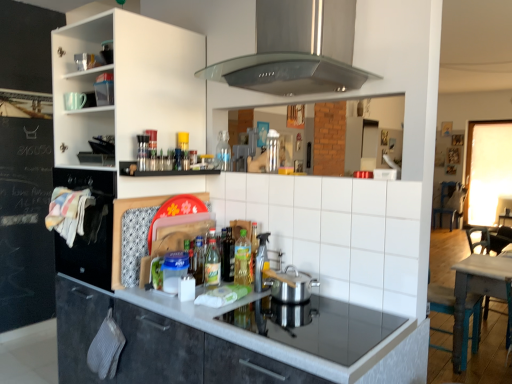
Question: Does green plastic bottle at center, which is counted as the 2th bottle, starting from the front, have a smaller size compared to wooden chair at right, which is the 2th chair in right-to-left order?

Choices:
 (A) yes
 (B) no

Answer: (A)

Question: Is green plastic bottle at center, the third bottle when ordered from back to front, aimed at wooden chair at right, which ranks as the second chair in back-to-front order?

Choices:
 (A) no
 (B) yes

Answer: (A)

Question: Is wooden chair at right, the first chair viewed from the left, inside green plastic bottle at center, the third bottle when ordered from back to front?

Choices:
 (A) no
 (B) yes

Answer: (A)

Question: From the image's perspective, is green plastic bottle at center, positioned as the 2th bottle in bottom-to-top order, located above wooden chair at right, the first chair viewed from the left?

Choices:
 (A) yes
 (B) no

Answer: (A)

Question: Is green plastic bottle at center, the 3th bottle in the top-to-bottom sequence, not close to wooden chair at right, which ranks as the second chair in back-to-front order?

Choices:
 (A) yes
 (B) no

Answer: (A)

Question: Can you confirm if green plastic bottle at center, the 3th bottle in the top-to-bottom sequence, is positioned to the left of wooden chair at right, which ranks as the second chair in back-to-front order?

Choices:
 (A) no
 (B) yes

Answer: (B)

Question: Can we say dark gray laminate cabinet at center lies outside metallic silver shelf at upper center?

Choices:
 (A) no
 (B) yes

Answer: (B)

Question: Is dark gray laminate cabinet at center thinner than metallic silver shelf at upper center?

Choices:
 (A) yes
 (B) no

Answer: (B)

Question: Is the position of dark gray laminate cabinet at center less distant than that of metallic silver shelf at upper center?

Choices:
 (A) no
 (B) yes

Answer: (B)

Question: Does dark gray laminate cabinet at center have a lesser height compared to metallic silver shelf at upper center?

Choices:
 (A) no
 (B) yes

Answer: (A)

Question: From a real-world perspective, is dark gray laminate cabinet at center located beneath metallic silver shelf at upper center?

Choices:
 (A) yes
 (B) no

Answer: (A)

Question: Is dark gray laminate cabinet at center not close to metallic silver shelf at upper center?

Choices:
 (A) yes
 (B) no

Answer: (B)

Question: Can you confirm if green plastic bottle at center, the third bottle when ordered from back to front, is positioned to the left of translucent plastic bottles at center, which is the third bottle from front to back?

Choices:
 (A) no
 (B) yes

Answer: (A)